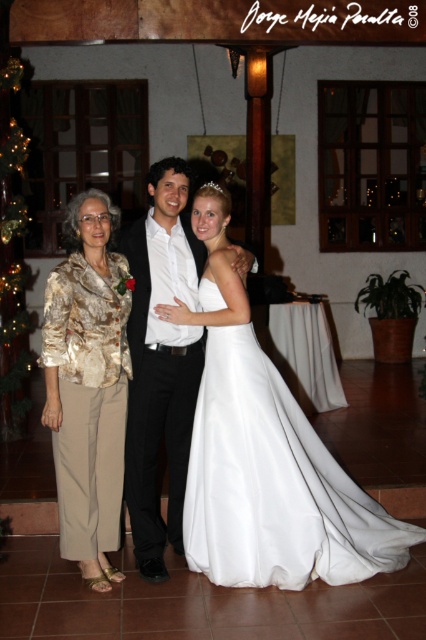
Question: Where is gold textured blouse at left located in relation to shiny black suit at center in the image?

Choices:
 (A) above
 (B) below

Answer: (B)

Question: Based on their relative distances, which object is farther from the gold textured blouse at left?

Choices:
 (A) white satin dress at center
 (B) shiny black suit at center

Answer: (A)

Question: Does gold textured blouse at left have a larger size compared to shiny black suit at center?

Choices:
 (A) no
 (B) yes

Answer: (A)

Question: Which of the following is the farthest from the observer?

Choices:
 (A) (65, 339)
 (B) (193, 292)
 (C) (239, 364)

Answer: (B)

Question: Which of these objects is positioned farthest from the shiny black suit at center?

Choices:
 (A) white satin dress at center
 (B) gold textured blouse at left

Answer: (A)

Question: Can you confirm if gold textured blouse at left is bigger than shiny black suit at center?

Choices:
 (A) no
 (B) yes

Answer: (A)